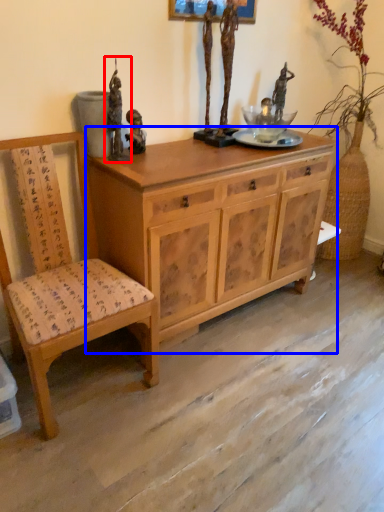
Question: Which object is further to the camera taking this photo, sculpture (highlighted by a red box) or cabinetry (highlighted by a blue box)?

Choices:
 (A) sculpture
 (B) cabinetry

Answer: (A)